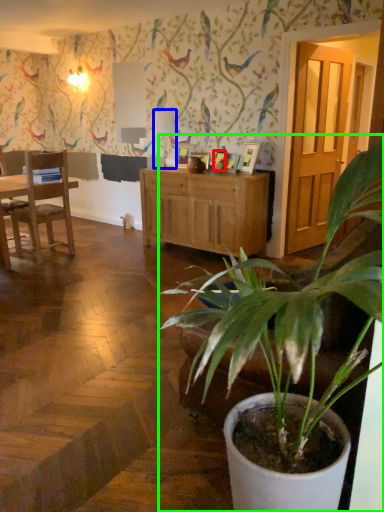
Question: Considering the real-world distances, which object is closest to picture frame (highlighted by a red box)? lamp (highlighted by a blue box) or houseplant (highlighted by a green box).

Choices:
 (A) lamp
 (B) houseplant

Answer: (A)